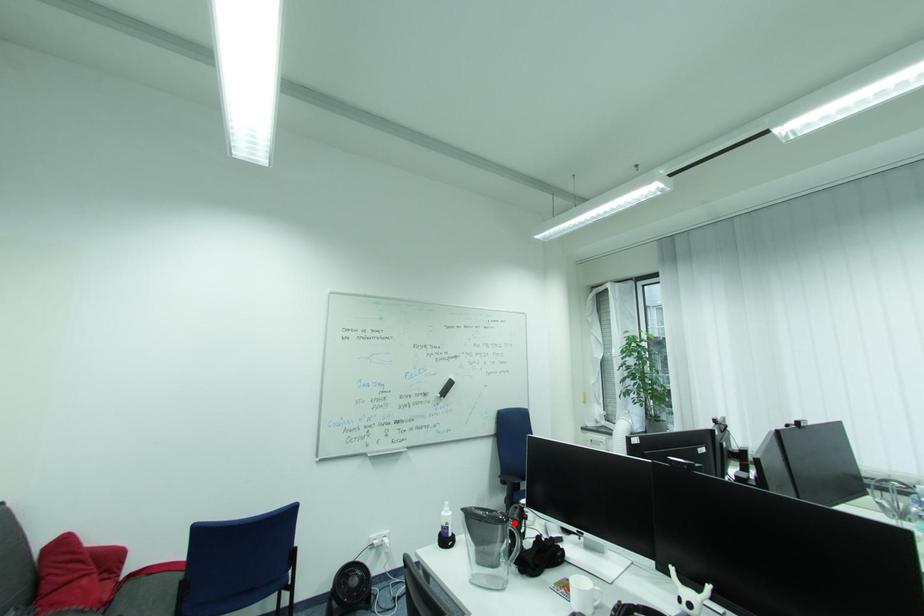
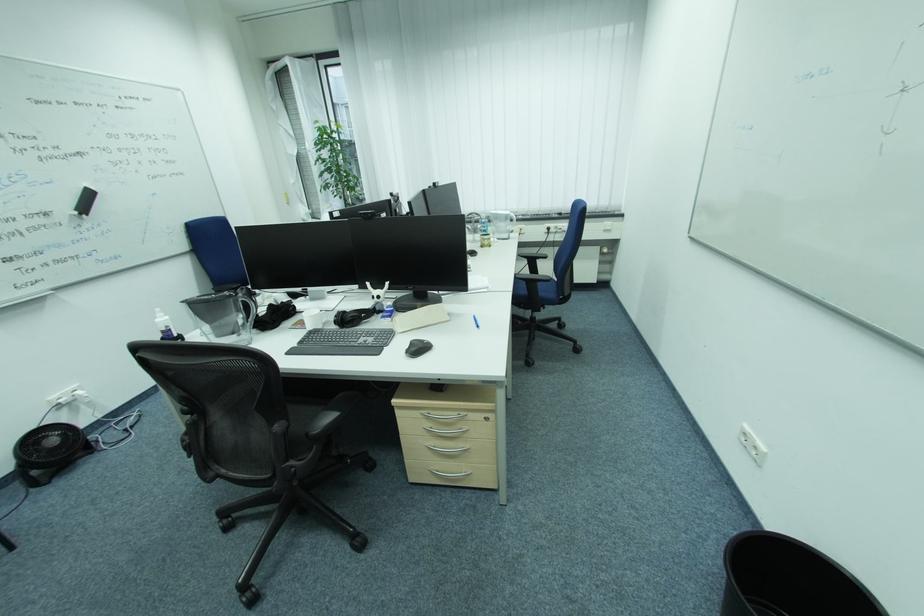
Question: I am providing you with two images of the same scene from different viewpoints. Given a red point in image1, look at the same physical point in image2. Is it:

Choices:
 (A) Closer to the viewpoint
 (B) Farther from the viewpoint

Answer: (B)